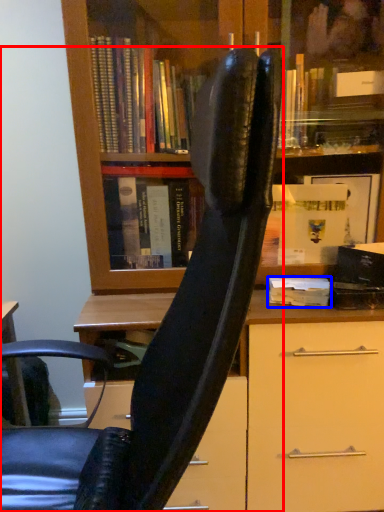
Question: Which object is further to the camera taking this photo, chair (highlighted by a red box) or book (highlighted by a blue box)?

Choices:
 (A) chair
 (B) book

Answer: (B)